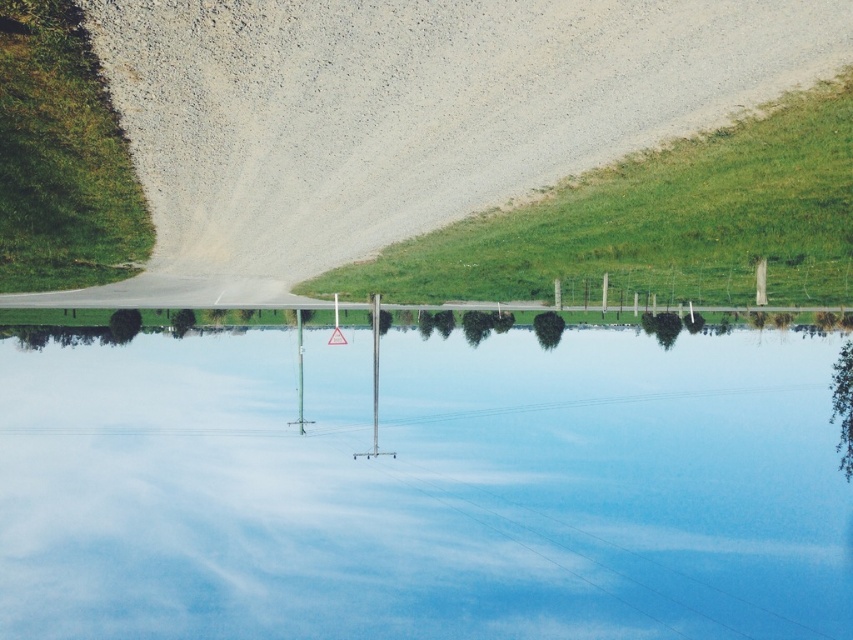
Question: Which object is the farthest from the green grass at upper right?

Choices:
 (A) transparent glass lake at center
 (B) green grass at left

Answer: (A)

Question: Among these objects, which one is nearest to the camera?

Choices:
 (A) transparent glass lake at center
 (B) green grass at upper right
 (C) green grass at left

Answer: (C)

Question: Which point is closer to the camera taking this photo?

Choices:
 (A) (459, 275)
 (B) (35, 445)

Answer: (A)

Question: Where is transparent glass lake at center located in relation to green grass at upper right in the image?

Choices:
 (A) right
 (B) left

Answer: (B)

Question: Is transparent glass lake at center below green grass at upper right?

Choices:
 (A) no
 (B) yes

Answer: (B)

Question: Is transparent glass lake at center positioned at the back of green grass at left?

Choices:
 (A) yes
 (B) no

Answer: (A)